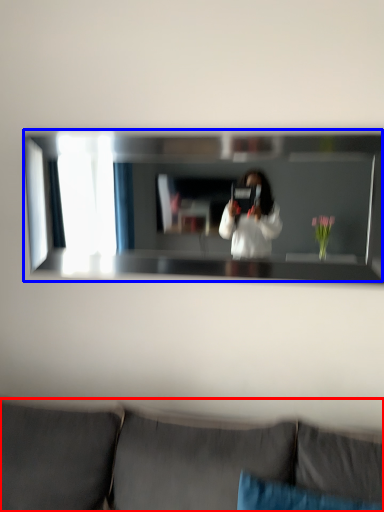
Question: Which object is further to the camera taking this photo, studio couch (highlighted by a red box) or mirror (highlighted by a blue box)?

Choices:
 (A) studio couch
 (B) mirror

Answer: (B)